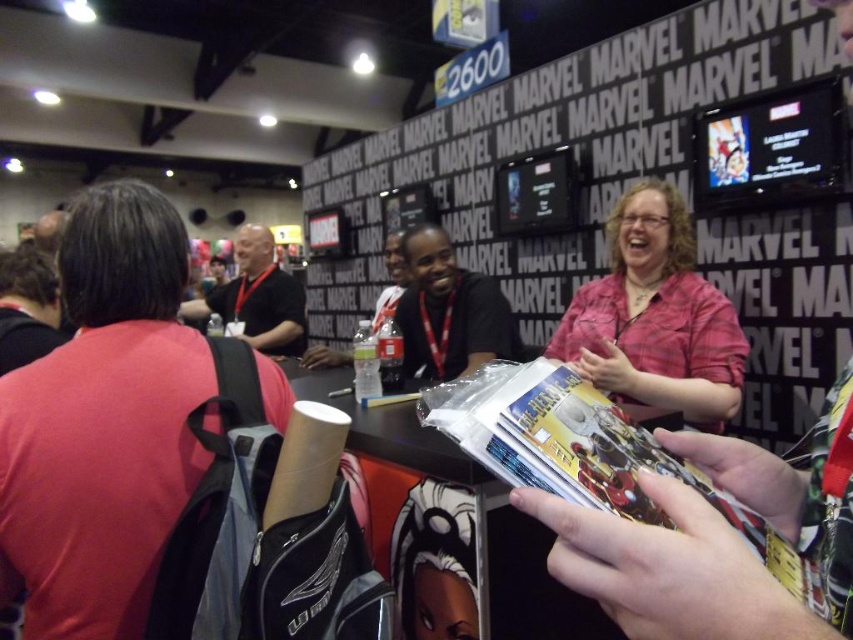
Question: Among these objects, which one is nearest to the camera?

Choices:
 (A) pink plaid shirt at center
 (B) red fabric shirt at left
 (C) matte plastic magazine at center

Answer: (C)

Question: Does red fabric shirt at left appear over pink plaid shirt at center?

Choices:
 (A) no
 (B) yes

Answer: (A)

Question: Which object is positioned closest to the black shirt at left?

Choices:
 (A) pink plaid shirt at center
 (B) black matte shirt at center
 (C) red fabric shirt at left
 (D) matte plastic magazine at center

Answer: (B)

Question: Is the position of red fabric shirt at left less distant than that of pink plaid shirt at center?

Choices:
 (A) no
 (B) yes

Answer: (B)

Question: Can you confirm if red fabric shirt at left is positioned above pink plaid shirt at center?

Choices:
 (A) yes
 (B) no

Answer: (B)

Question: Which point appears farthest from the camera in this image?

Choices:
 (A) (677, 256)
 (B) (477, 300)

Answer: (B)